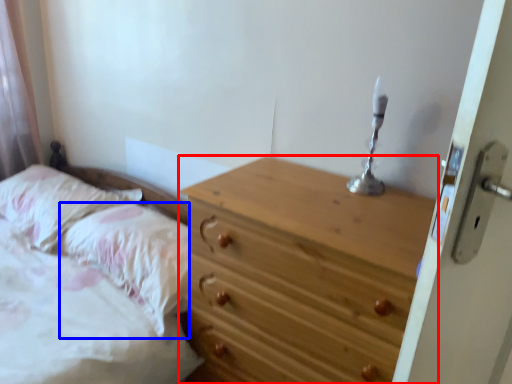
Question: Which of the following is the closest to the observer, chest of drawers (highlighted by a red box) or pillow (highlighted by a blue box)?

Choices:
 (A) chest of drawers
 (B) pillow

Answer: (A)